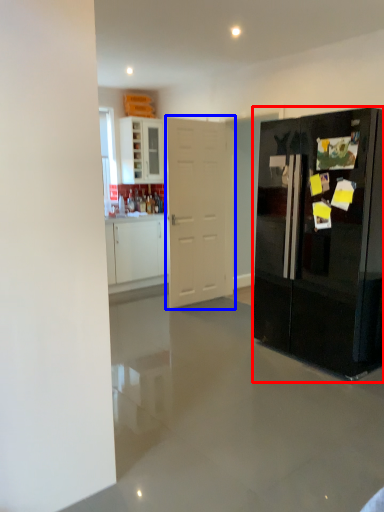
Question: Which point is closer to the camera, refrigerator (highlighted by a red box) or door (highlighted by a blue box)?

Choices:
 (A) refrigerator
 (B) door

Answer: (A)